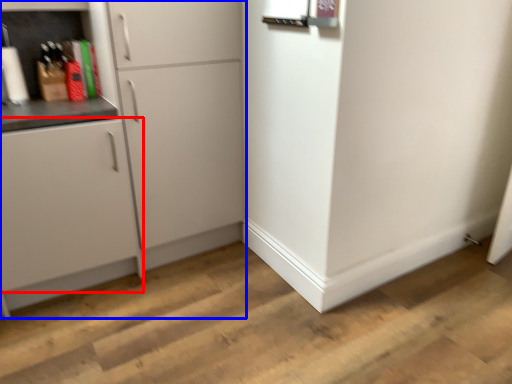
Question: Which object appears farthest to the camera in this image, cabinetry (highlighted by a red box) or cabinetry (highlighted by a blue box)?

Choices:
 (A) cabinetry
 (B) cabinetry

Answer: (B)